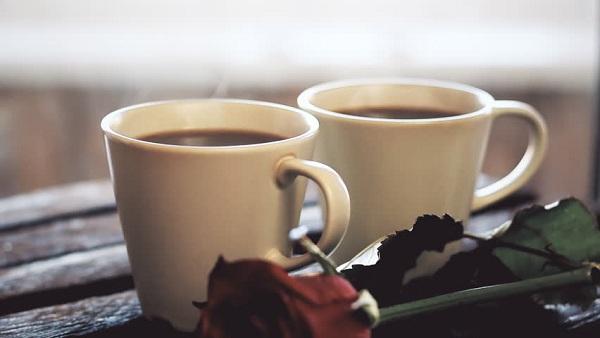
Identify the location of mug. This screenshot has width=600, height=338. click(x=176, y=267).